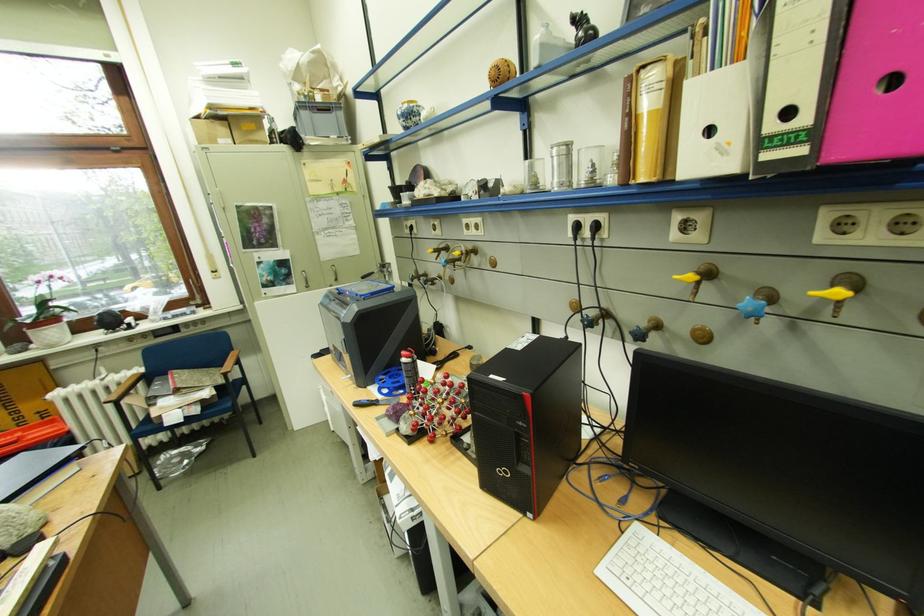
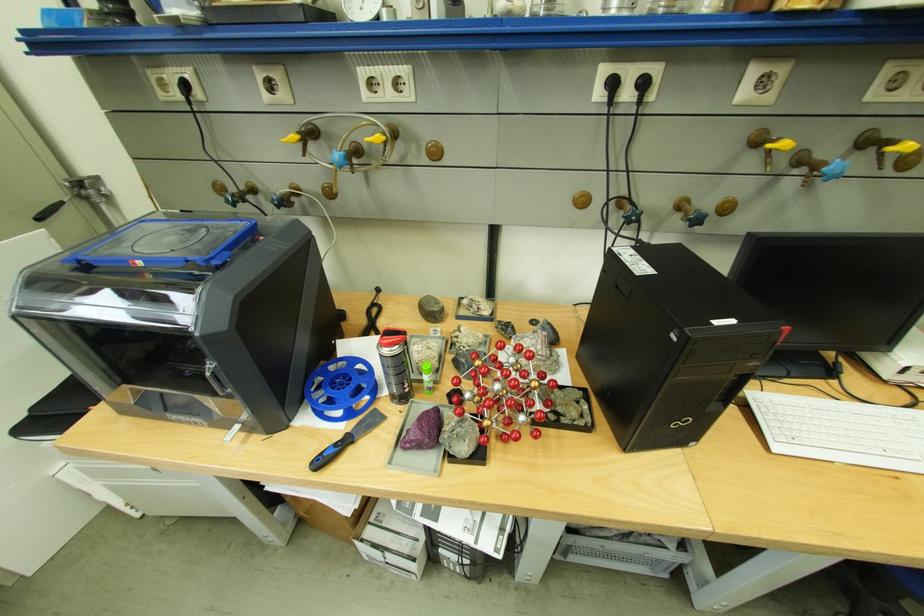
Find the pixel in the second image that matches (395,392) in the first image.

(349, 413)